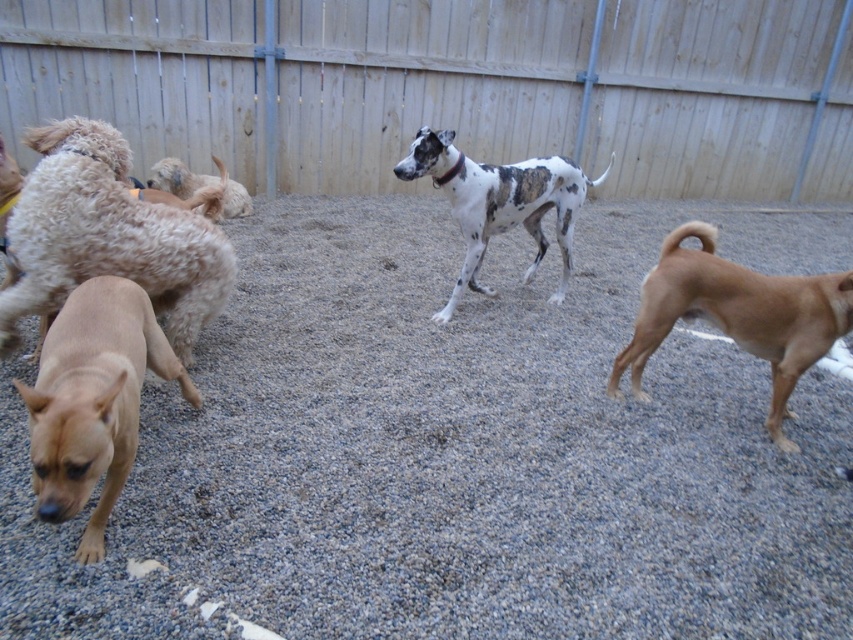
Question: Is gray gravel at lower left smaller than speckled fur dog at center?

Choices:
 (A) yes
 (B) no

Answer: (B)

Question: Does gray gravel at lower left appear on the left side of wooden fence at upper center?

Choices:
 (A) yes
 (B) no

Answer: (B)

Question: Can you confirm if brown matte dog at lower left is thinner than fuzzy beige dog at upper left?

Choices:
 (A) yes
 (B) no

Answer: (A)

Question: Which point is farther from the camera taking this photo?

Choices:
 (A) (408, 122)
 (B) (653, 330)

Answer: (A)

Question: Which object is positioned farthest from the wooden fence at upper center?

Choices:
 (A) brown smooth dog at right
 (B) gray gravel at lower left
 (C) light brown fluffy dog at left
 (D) fuzzy beige dog at upper left

Answer: (A)

Question: Which point is closer to the camera taking this photo?

Choices:
 (A) (250, 45)
 (B) (799, 420)

Answer: (B)